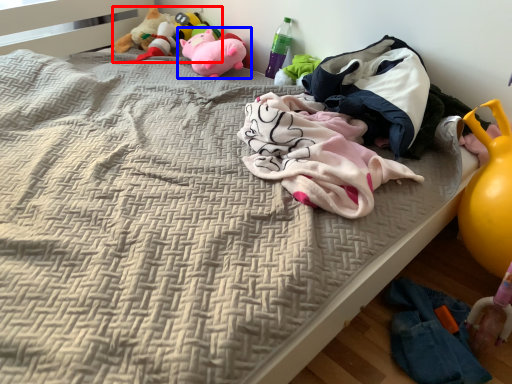
Question: Which of the following is the farthest to the observer, toy (highlighted by a red box) or toy (highlighted by a blue box)?

Choices:
 (A) toy
 (B) toy

Answer: (A)